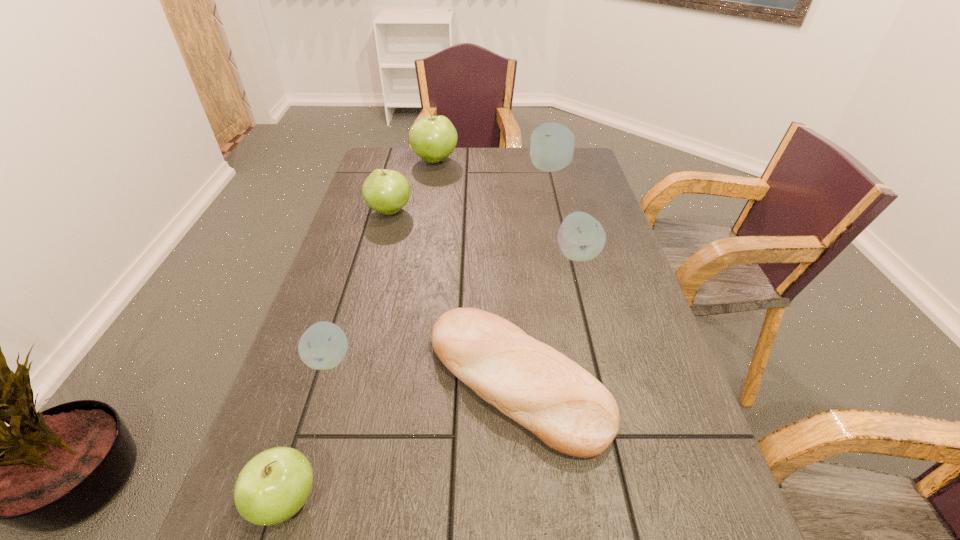
Locate an element on the screen. This screenshot has height=540, width=960. the tallest object is located at coordinates (433, 138).

Where is `the biggest green apple`? the biggest green apple is located at coordinates (433, 138).

Where is `the biggest white apple`? This screenshot has width=960, height=540. the biggest white apple is located at coordinates (552, 145).

Image resolution: width=960 pixels, height=540 pixels. I want to click on the second smallest green apple, so click(386, 191).

At what (x,y) coordinates should I click in order to perform the action: click on the second nearest green apple. Please return your answer as a coordinate pair (x, y). Looking at the image, I should click on (386, 191).

Where is `the fourth farthest apple`? This screenshot has height=540, width=960. the fourth farthest apple is located at coordinates (581, 237).

You are a GUI agent. You are given a task and a screenshot of the screen. Output one action in this format:
    pyautogui.click(x=<x>, y=<y>)
    Task: Click on the fourth farthest object
    
    Given the screenshot: What is the action you would take?
    pyautogui.click(x=581, y=237)

Locate an element on the screen. Image resolution: width=960 pixels, height=540 pixels. the nearest object is located at coordinates (274, 485).

Find the location of a particular element. the nearest apple is located at coordinates (274, 485).

Image resolution: width=960 pixels, height=540 pixels. I want to click on bread, so click(x=552, y=396).